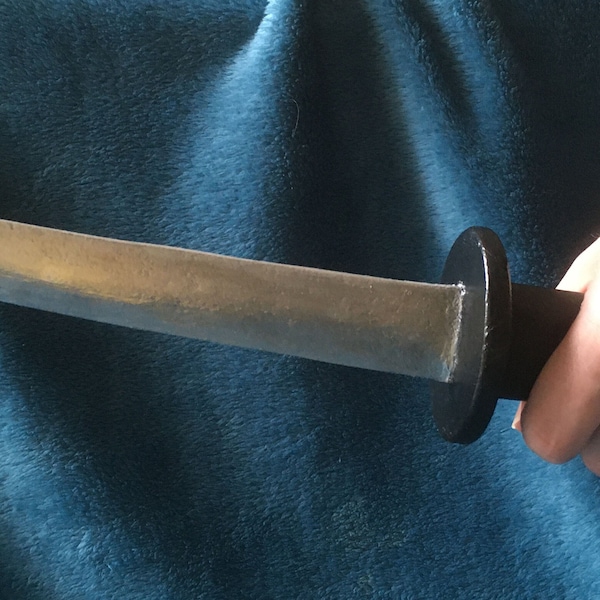
The width and height of the screenshot is (600, 600). Identify the location of blanket. (320, 237).